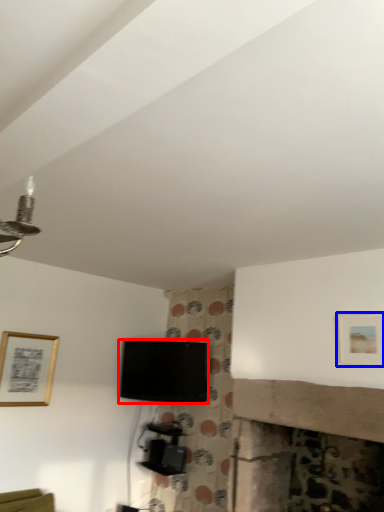
Question: Which object appears closest to the camera in this image, television (highlighted by a red box) or picture frame (highlighted by a blue box)?

Choices:
 (A) television
 (B) picture frame

Answer: (B)